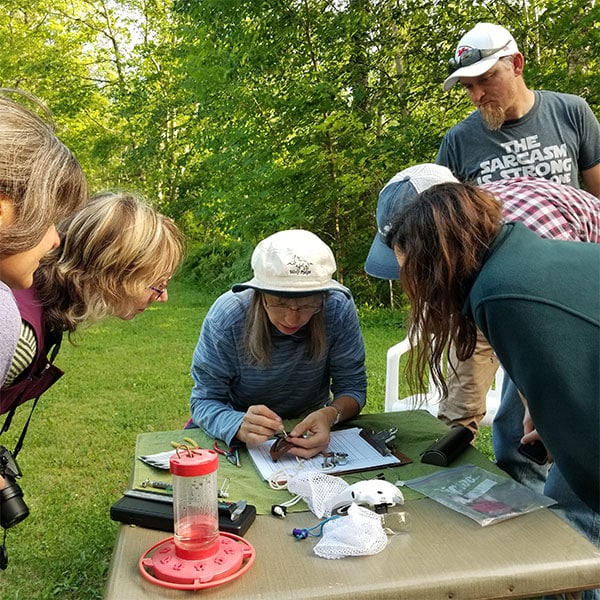
This screenshot has width=600, height=600. I want to click on table, so click(x=472, y=558).